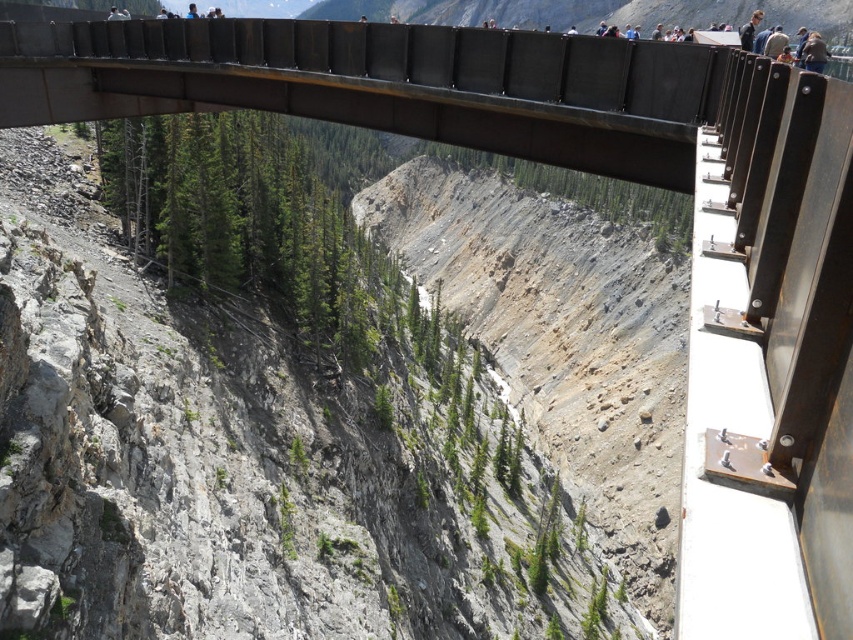
Question: Among these objects, which one is farthest from the camera?

Choices:
 (A) dull gray rock at center
 (B) dark brown leather jacket at upper center

Answer: (A)

Question: Among these objects, which one is farthest from the camera?

Choices:
 (A) metallic bridge at center
 (B) dull gray rock at center

Answer: (B)

Question: Does metallic bridge at center appear under dull gray rock at center?

Choices:
 (A) no
 (B) yes

Answer: (B)

Question: Can you confirm if dull gray rock at center is positioned below dark brown leather jacket at upper center?

Choices:
 (A) yes
 (B) no

Answer: (B)

Question: Which point is closer to the camera taking this photo?

Choices:
 (A) (822, 60)
 (B) (527, 253)

Answer: (A)

Question: Does metallic bridge at center have a smaller size compared to dark brown leather jacket at upper center?

Choices:
 (A) no
 (B) yes

Answer: (A)